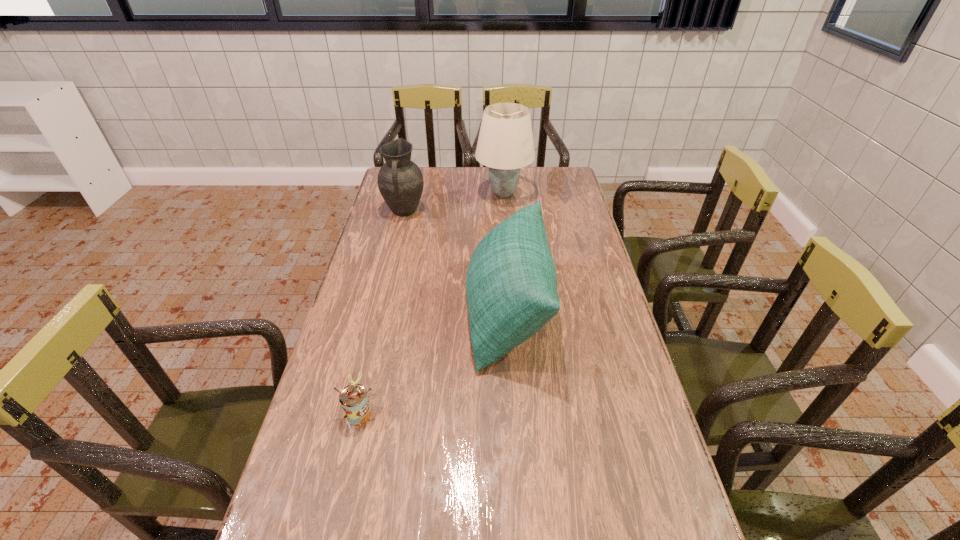
Image resolution: width=960 pixels, height=540 pixels. What are the coordinates of `vacant region located on the back of the nearest object` in the screenshot? It's located at (388, 289).

I want to click on object that is positioned at the far edge, so click(505, 144).

I want to click on pitcher that is at the left edge, so click(400, 181).

The width and height of the screenshot is (960, 540). I want to click on can located in the left edge section of the desktop, so click(x=353, y=398).

This screenshot has width=960, height=540. In the image, there is a desktop. What are the coordinates of `vacant area at the far edge` in the screenshot? It's located at (516, 192).

The width and height of the screenshot is (960, 540). In order to click on vacant space at the left edge of the desktop in this screenshot , I will do `click(356, 328)`.

Find the location of `free space at the right edge of the desktop`. free space at the right edge of the desktop is located at coordinates (613, 302).

You are a GUI agent. You are given a task and a screenshot of the screen. Output one action in this format:
    pyautogui.click(x=<x>, y=<y>)
    Task: Click on the free space at the far right corner
    The image size is (960, 540).
    Given the screenshot: What is the action you would take?
    pyautogui.click(x=560, y=169)

Locate an element on the screen. The image size is (960, 540). free space between the cushion and the pitcher is located at coordinates (456, 262).

Locate an element on the screen. This screenshot has width=960, height=540. vacant space that's between the cushion and the shortest object is located at coordinates (434, 362).